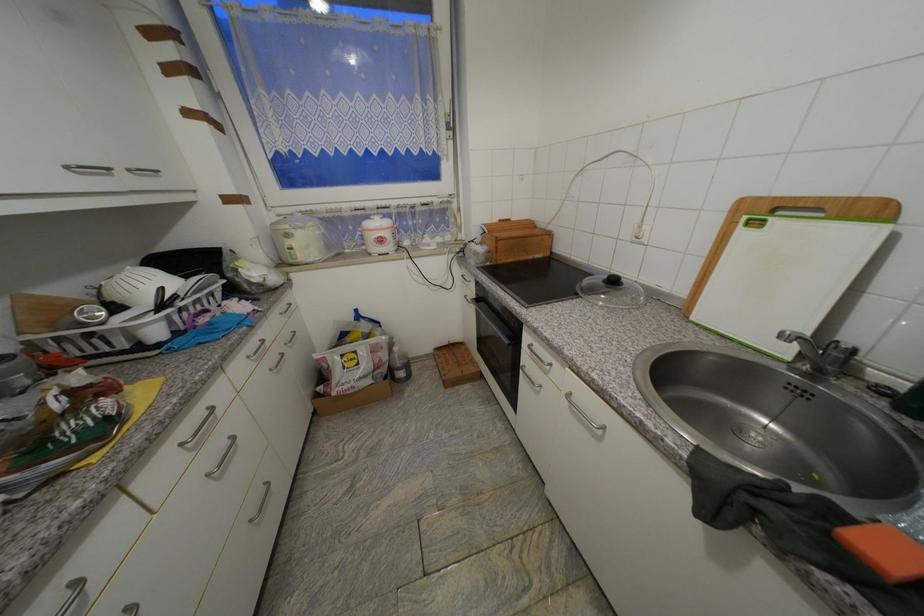
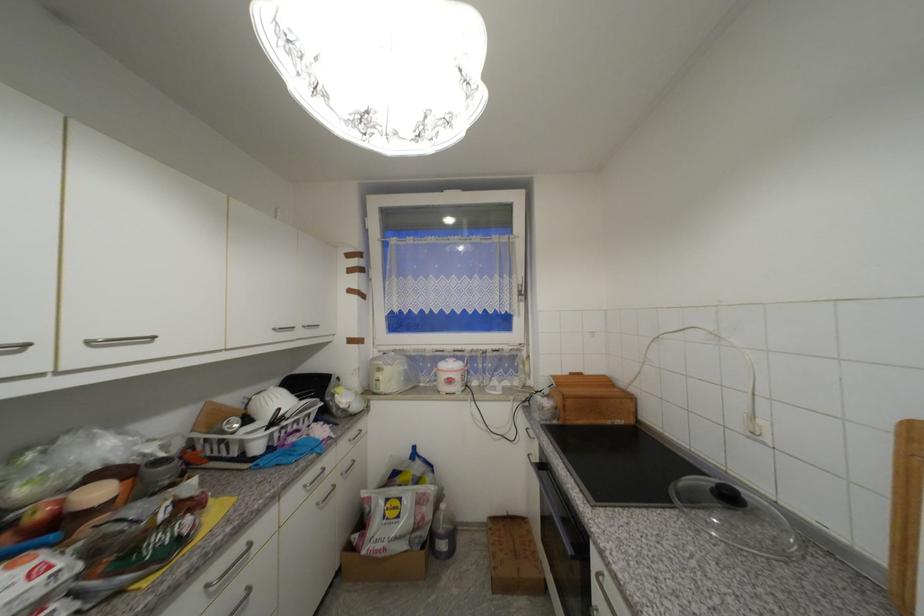
The point at [188,446] is marked in the first image. Where is the corresponding point in the second image?

(213, 588)